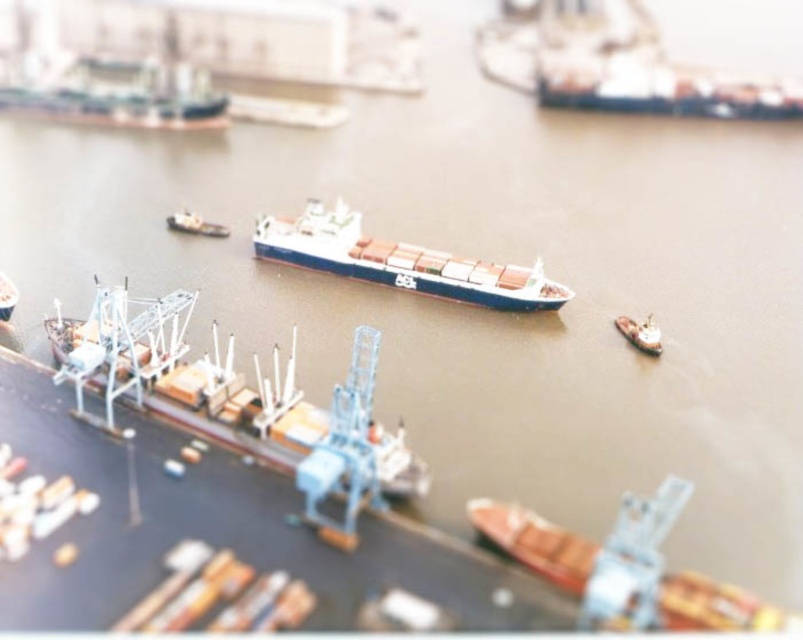
Question: Does white matte cargo ship at upper right have a larger size compared to blue metallic cargo ship at upper left?

Choices:
 (A) yes
 (B) no

Answer: (A)

Question: Can you confirm if blue matte cargo ship at center is positioned below blue metallic cargo ship at upper left?

Choices:
 (A) yes
 (B) no

Answer: (A)

Question: Which point is farther from the camera taking this photo?

Choices:
 (A) (565, 106)
 (B) (381, 252)
 (C) (655, 337)

Answer: (A)

Question: Which point appears farthest from the camera in this image?

Choices:
 (A) (577, 579)
 (B) (381, 272)
 (C) (241, 412)
 (D) (695, 93)

Answer: (D)

Question: Among these points, which one is farthest from the camera?

Choices:
 (A) pos(598,72)
 (B) pos(312,202)

Answer: (A)

Question: Does blue metallic cargo ship at upper left have a smaller size compared to metallic silver boat at center?

Choices:
 (A) no
 (B) yes

Answer: (A)